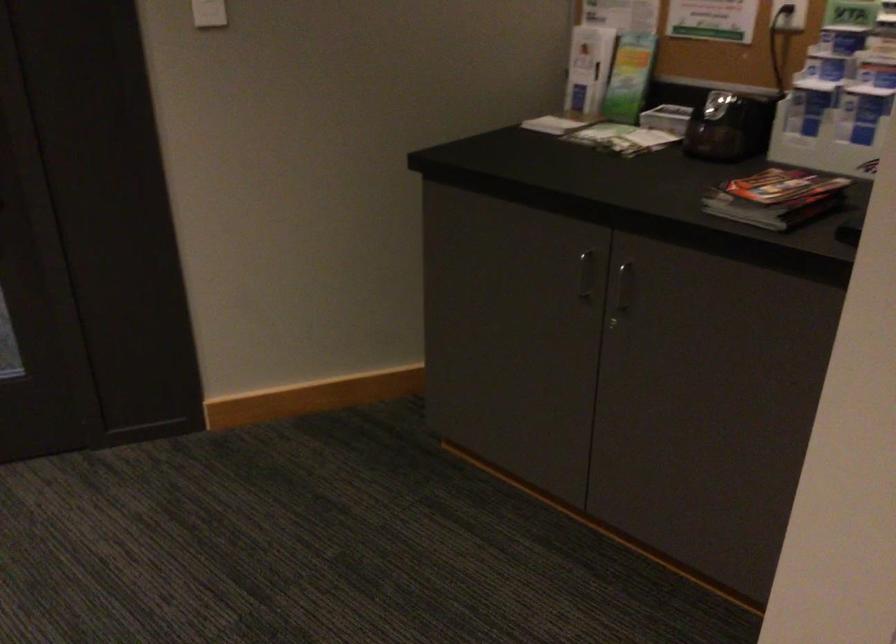
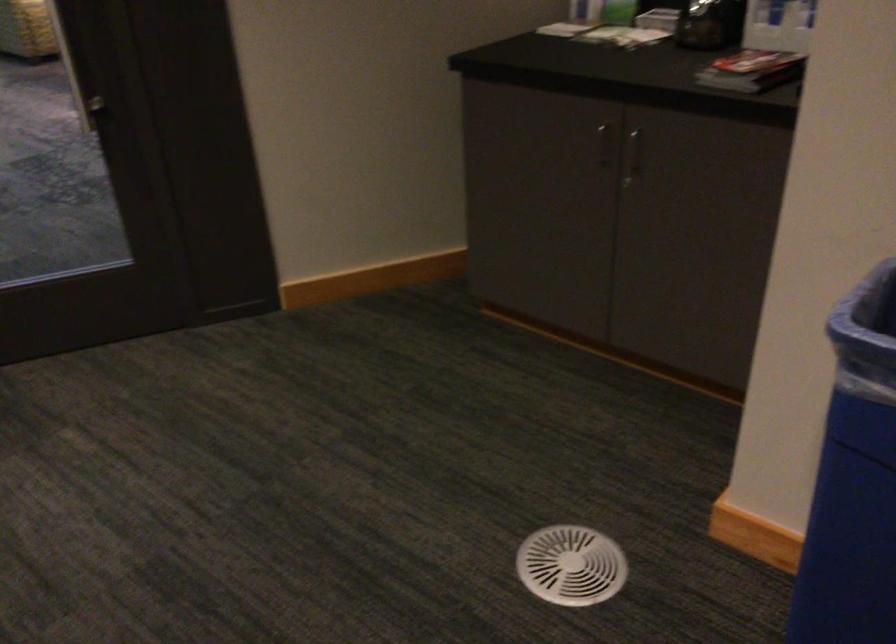
What movement of the cameraman would produce the second image?

The movement direction of the cameraman is left, backward.